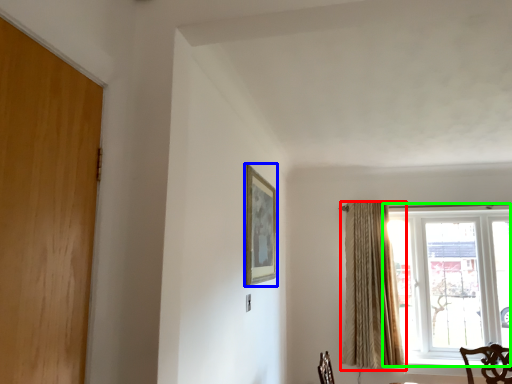
Question: Based on their relative distances, which object is nearer to curtain (highlighted by a red box)? Choose from picture frame (highlighted by a blue box) and window (highlighted by a green box).

Choices:
 (A) picture frame
 (B) window

Answer: (B)